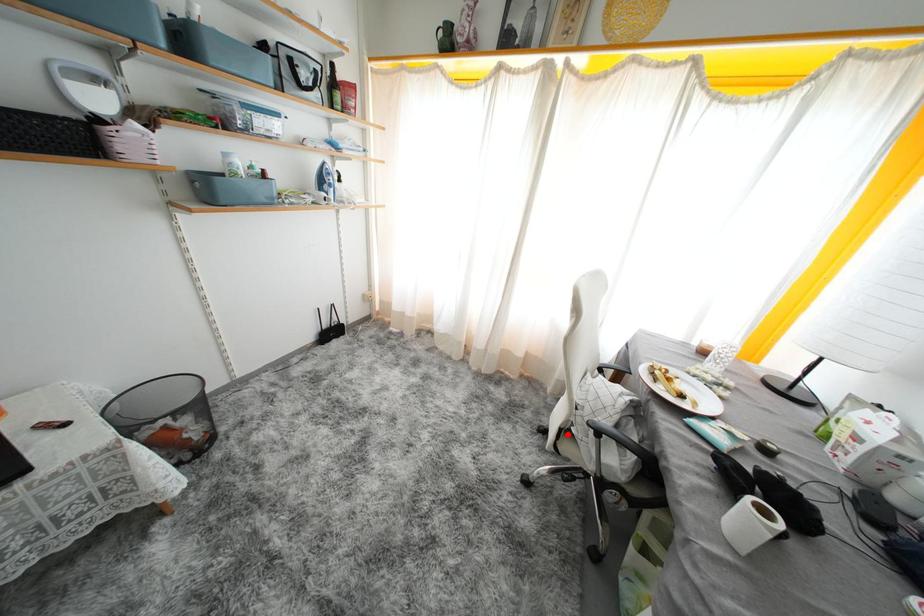
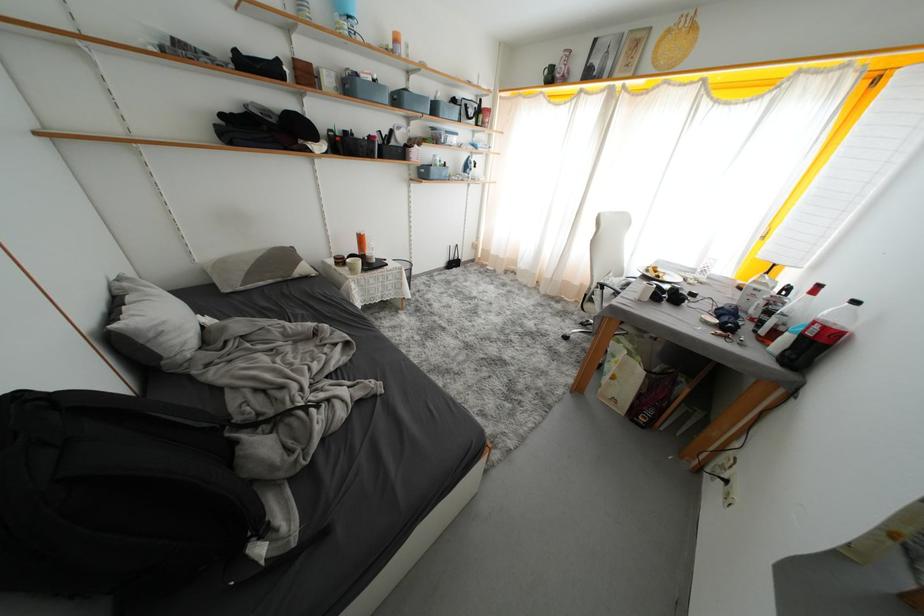
Question: A red point is marked in image1. In image2, is the corresponding 3D point closer to the camera or farther? Reply with the corresponding letter.

Choices:
 (A) The corresponding 3D point is closer.
 (B) The corresponding 3D point is farther.

Answer: (B)